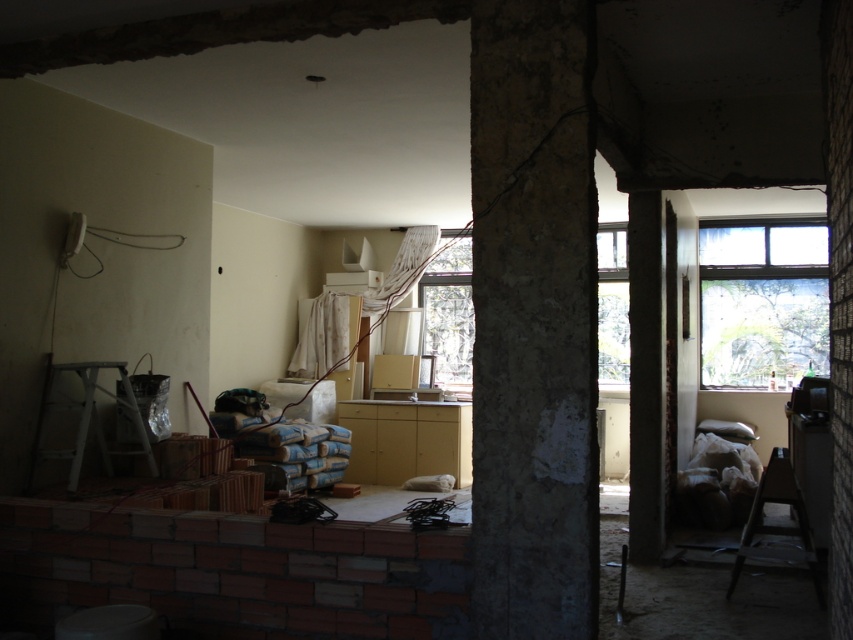
Question: Which point is farther to the camera?

Choices:
 (A) transparent plastic window at center
 (B) transparent glass window at upper right

Answer: (A)

Question: Does transparent glass window at upper right appear on the left side of wooden at right?

Choices:
 (A) yes
 (B) no

Answer: (B)

Question: Is transparent plastic window at center positioned before white matte ladder at lower left?

Choices:
 (A) yes
 (B) no

Answer: (B)

Question: Which point appears closest to the camera in this image?

Choices:
 (A) (482, 509)
 (B) (718, 321)
 (C) (608, 262)
 (D) (758, 486)

Answer: (A)

Question: Is transparent glass window at upper right to the left of wooden at right from the viewer's perspective?

Choices:
 (A) yes
 (B) no

Answer: (B)

Question: Which point is farther from the camera taking this photo?

Choices:
 (A) (148, 465)
 (B) (769, 266)
 (C) (598, 252)
 (D) (538, 576)

Answer: (C)